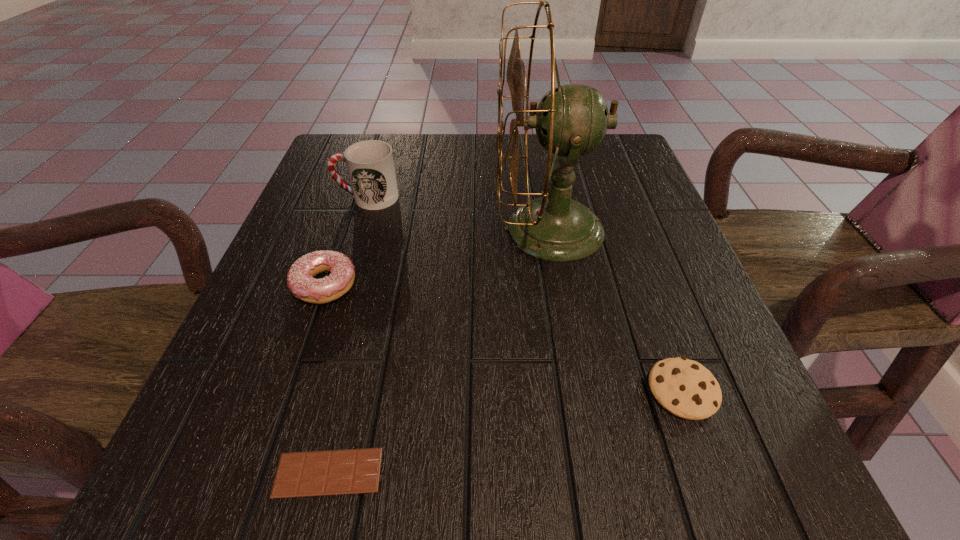
I want to click on the tallest object, so click(x=571, y=120).

I want to click on cup, so click(x=370, y=164).

You are a GUI agent. You are given a task and a screenshot of the screen. Output one action in this format:
    pyautogui.click(x=<x>, y=<y>)
    Task: Click on the third tallest object
    This screenshot has width=960, height=540.
    Given the screenshot: What is the action you would take?
    pyautogui.click(x=300, y=279)

The width and height of the screenshot is (960, 540). Find the location of `cookie`. cookie is located at coordinates (685, 388).

What are the coordinates of `the fourth farthest object` in the screenshot? It's located at (685, 388).

Identify the location of the nearest object. (318, 473).

This screenshot has width=960, height=540. What are the coordinates of `chocolate bar` in the screenshot? It's located at (318, 473).

What are the coordinates of `vacant space located 0.340m in front of the tallest object, directing air flow` in the screenshot? It's located at (333, 228).

Where is `free spot located 0.140m in front of the tallest object, directing air flow`? The width and height of the screenshot is (960, 540). free spot located 0.140m in front of the tallest object, directing air flow is located at coordinates (429, 228).

Where is `vacant space located 0.100m in front of the tallest object, directing air flow`? The width and height of the screenshot is (960, 540). vacant space located 0.100m in front of the tallest object, directing air flow is located at coordinates (448, 228).